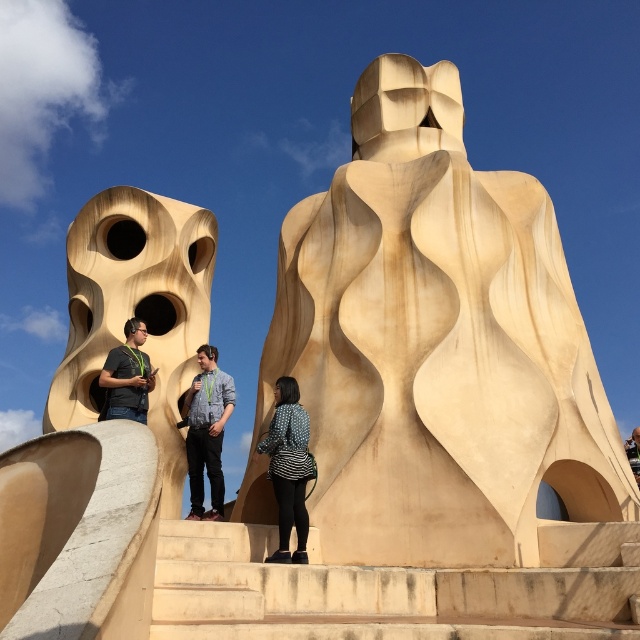
Question: Is beige stone stairs at center wider than beige textured sculpture at left?

Choices:
 (A) no
 (B) yes

Answer: (A)

Question: Which of the following is the farthest from the observer?

Choices:
 (A) beige smooth sculpture at center
 (B) patterned fabric coat at center
 (C) matte black shirt at center

Answer: (C)

Question: Can you confirm if beige smooth sculpture at center is positioned to the right of denim shirt at center?

Choices:
 (A) no
 (B) yes

Answer: (B)

Question: Which object is positioned closest to the patterned fabric coat at center?

Choices:
 (A) beige smooth sculpture at center
 (B) matte black shirt at center
 (C) denim shirt at center

Answer: (C)

Question: Is beige textured sculpture at left to the left of matte black shirt at center from the viewer's perspective?

Choices:
 (A) no
 (B) yes

Answer: (B)

Question: Which object is the closest to the beige stone stairs at center?

Choices:
 (A) patterned fabric coat at center
 (B) beige textured sculpture at left
 (C) matte black shirt at center
 (D) beige smooth sculpture at center

Answer: (A)